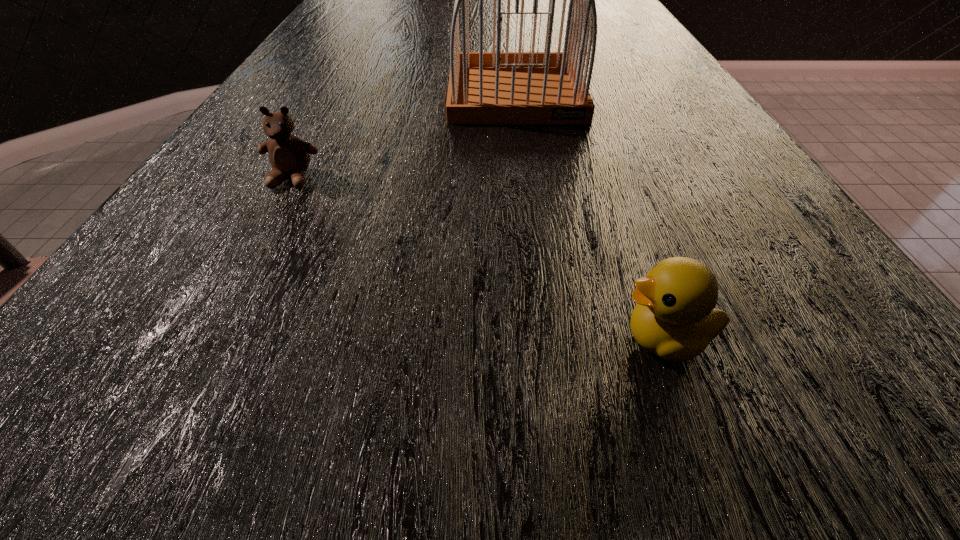
This screenshot has width=960, height=540. In order to click on vacant area that lies between the second farthest object and the nearest object in this screenshot , I will do `click(479, 259)`.

Find the location of a particular element. free point between the tallest object and the duck is located at coordinates (590, 216).

You are a GUI agent. You are given a task and a screenshot of the screen. Output one action in this format:
    pyautogui.click(x=<x>, y=<y>)
    Task: Click on the free spot between the birdcage and the second farthest object
    This screenshot has width=960, height=540.
    Given the screenshot: What is the action you would take?
    pyautogui.click(x=404, y=136)

Find the location of a particular element. This screenshot has width=960, height=540. unoccupied position between the leftmost object and the tallest object is located at coordinates (404, 136).

The width and height of the screenshot is (960, 540). I want to click on free area in between the second nearest object and the farthest object, so click(x=404, y=136).

Where is `free space between the second farthest object and the duck`? This screenshot has width=960, height=540. free space between the second farthest object and the duck is located at coordinates (479, 259).

This screenshot has width=960, height=540. I want to click on unoccupied area between the birdcage and the nearest object, so click(590, 216).

Identify the location of object that can be found as the closest to the second farthest object. (498, 87).

Locate an element on the screen. This screenshot has height=540, width=960. the closest object to the duck is located at coordinates (498, 87).